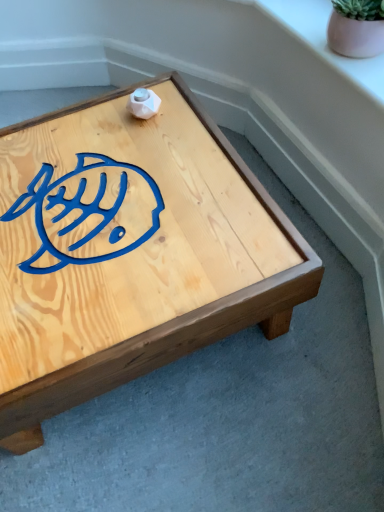
Question: Is pink matte flowerpot at upper right closer to camera compared to pink ceramic pot at upper right?

Choices:
 (A) no
 (B) yes

Answer: (B)

Question: Is pink matte flowerpot at upper right far from pink ceramic pot at upper right?

Choices:
 (A) yes
 (B) no

Answer: (B)

Question: Is pink matte flowerpot at upper right positioned beyond the bounds of pink ceramic pot at upper right?

Choices:
 (A) yes
 (B) no

Answer: (A)

Question: Does pink matte flowerpot at upper right lie behind pink ceramic pot at upper right?

Choices:
 (A) no
 (B) yes

Answer: (A)

Question: Does pink matte flowerpot at upper right have a lesser width compared to pink ceramic pot at upper right?

Choices:
 (A) no
 (B) yes

Answer: (B)

Question: Considering the relative positions of natural wood coffee table at center and pink matte flowerpot at upper right in the image provided, is natural wood coffee table at center to the left or to the right of pink matte flowerpot at upper right?

Choices:
 (A) right
 (B) left

Answer: (B)

Question: From the image's perspective, is natural wood coffee table at center above or below pink matte flowerpot at upper right?

Choices:
 (A) above
 (B) below

Answer: (B)

Question: Considering the positions of natural wood coffee table at center and pink matte flowerpot at upper right in the image, is natural wood coffee table at center bigger or smaller than pink matte flowerpot at upper right?

Choices:
 (A) small
 (B) big

Answer: (B)

Question: Is natural wood coffee table at center inside or outside of pink matte flowerpot at upper right?

Choices:
 (A) outside
 (B) inside

Answer: (A)

Question: Considering the positions of natural wood coffee table at center and pink ceramic pot at upper right in the image, is natural wood coffee table at center wider or thinner than pink ceramic pot at upper right?

Choices:
 (A) thin
 (B) wide

Answer: (B)

Question: From the image's perspective, relative to pink ceramic pot at upper right, is natural wood coffee table at center above or below?

Choices:
 (A) below
 (B) above

Answer: (A)

Question: Looking at the image, does natural wood coffee table at center seem bigger or smaller compared to pink ceramic pot at upper right?

Choices:
 (A) big
 (B) small

Answer: (A)

Question: From a real-world perspective, is natural wood coffee table at center physically located above or below pink ceramic pot at upper right?

Choices:
 (A) below
 (B) above

Answer: (A)

Question: From the image's perspective, relative to pink ceramic pot at upper right, is pink matte flowerpot at upper right above or below?

Choices:
 (A) above
 (B) below

Answer: (B)

Question: Based on their sizes in the image, would you say pink matte flowerpot at upper right is bigger or smaller than pink ceramic pot at upper right?

Choices:
 (A) big
 (B) small

Answer: (B)